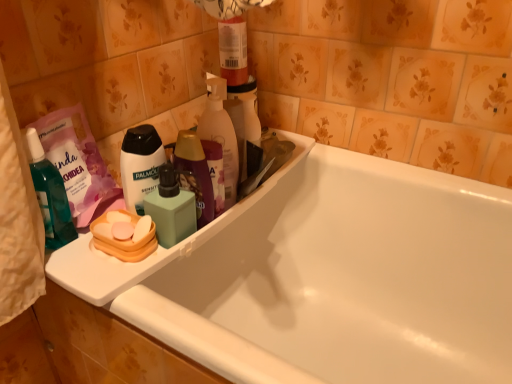
The width and height of the screenshot is (512, 384). Describe the element at coordinates (50, 195) in the screenshot. I see `translucent teal bottle at left, the second toiletry from the right` at that location.

In order to face white glossy bathtub at center, should I rotate leftwards or rightwards?

You should look right and rotate roughly 5.688 degrees.

Where is `white glossy bathtub at center`? The image size is (512, 384). white glossy bathtub at center is located at coordinates (328, 278).

Locate an element on the screen. This screenshot has height=384, width=512. green matte soap dispenser at center, the second toiletry positioned from the left is located at coordinates pos(170,208).

From a real-world perspective, between green matte soap dispenser at center, the first toiletry in the right-to-left sequence, and orange plastic soap at left, the first personal care in the bottom-to-top sequence, who is vertically higher?

green matte soap dispenser at center, the first toiletry in the right-to-left sequence, is physically above.

How many degrees apart are the facing directions of green matte soap dispenser at center, the second toiletry positioned from the left, and orange plastic soap at left, positioned as the 2th personal care in top-to-bottom order?

The facing directions of green matte soap dispenser at center, the second toiletry positioned from the left, and orange plastic soap at left, positioned as the 2th personal care in top-to-bottom order, are 0.00321 degrees apart.

Where is `toiletry that is behind the orange plastic soap at left, the first personal care in the bottom-to-top sequence`? The width and height of the screenshot is (512, 384). toiletry that is behind the orange plastic soap at left, the first personal care in the bottom-to-top sequence is located at coordinates (170, 208).

In the scene shown: Who is smaller, green matte soap dispenser at center, the first toiletry in the right-to-left sequence, or orange plastic soap at left, positioned as the 2th personal care in top-to-bottom order?

orange plastic soap at left, positioned as the 2th personal care in top-to-bottom order.

Considering the sizes of white glossy bathtub at center and orange plastic soap at left, the first personal care in the bottom-to-top sequence, in the image, is white glossy bathtub at center taller or shorter than orange plastic soap at left, the first personal care in the bottom-to-top sequence,?

In the image, white glossy bathtub at center appears to be taller than orange plastic soap at left, the first personal care in the bottom-to-top sequence.

Can you confirm if white glossy bathtub at center is positioned to the left of orange plastic soap at left, the first personal care in the bottom-to-top sequence?

Incorrect, white glossy bathtub at center is not on the left side of orange plastic soap at left, the first personal care in the bottom-to-top sequence.

Can you confirm if white glossy bathtub at center is wider than orange plastic soap at left, the first personal care in the bottom-to-top sequence?

Yes, white glossy bathtub at center is wider than orange plastic soap at left, the first personal care in the bottom-to-top sequence.

Is white glossy bathtub at center completely or partially outside of orange plastic soap at left, the first personal care in the bottom-to-top sequence?

white glossy bathtub at center is positioned outside orange plastic soap at left, the first personal care in the bottom-to-top sequence.

In terms of size, does white matte body wash at center, placed as the second personal care when sorted from bottom to top, appear bigger or smaller than orange plastic soap at left, the first personal care in the bottom-to-top sequence?

Considering their sizes, white matte body wash at center, placed as the second personal care when sorted from bottom to top, takes up more space than orange plastic soap at left, the first personal care in the bottom-to-top sequence.

Is white matte body wash at center, arranged as the 1th personal care when viewed from the top, inside or outside of orange plastic soap at left, positioned as the 2th personal care in top-to-bottom order?

white matte body wash at center, arranged as the 1th personal care when viewed from the top, exists outside the volume of orange plastic soap at left, positioned as the 2th personal care in top-to-bottom order.

Is white matte body wash at center, placed as the second personal care when sorted from bottom to top, oriented away from orange plastic soap at left, positioned as the 2th personal care in top-to-bottom order?

white matte body wash at center, placed as the second personal care when sorted from bottom to top, is not turned away from orange plastic soap at left, positioned as the 2th personal care in top-to-bottom order.

This screenshot has height=384, width=512. What are the coordinates of `personal care below the white matte body wash at center, arranged as the 1th personal care when viewed from the top (from the image's perspective)` in the screenshot? It's located at (124, 235).

Locate an element on the screen. This screenshot has height=384, width=512. sink below the translucent teal bottle at left, the first toiletry viewed from the left (from the image's perspective) is located at coordinates (152, 253).

Can you confirm if translucent teal bottle at left, the first toiletry viewed from the left, is positioned to the left of white plastic tray at upper left?

Yes.

Which object is further away from the camera, translucent teal bottle at left, the second toiletry from the right, or white plastic tray at upper left?

white plastic tray at upper left is further from the camera.

Is translucent teal bottle at left, the first toiletry viewed from the left, inside or outside of white plastic tray at upper left?

The correct answer is: outside.

Is translucent plastic bottle at upper center positioned far away from white glossy bathtub at center?

That's not correct — translucent plastic bottle at upper center is a little close to white glossy bathtub at center.

Is point (206, 133) positioned before point (386, 281)?

Yes, it is in front of point (386, 281).

From a real-world perspective, is translucent plastic bottle at upper center below white glossy bathtub at center?

No, from a real-world perspective, translucent plastic bottle at upper center is not under white glossy bathtub at center.

Is translucent plastic bottle at upper center oriented towards white glossy bathtub at center?

No, translucent plastic bottle at upper center is not aimed at white glossy bathtub at center.

Can you confirm if translucent teal bottle at left, the second toiletry from the right, is wider than white glossy bathtub at center?

Incorrect, the width of translucent teal bottle at left, the second toiletry from the right, does not surpass that of white glossy bathtub at center.

From the image's perspective, is translucent teal bottle at left, the first toiletry viewed from the left, under white glossy bathtub at center?

No, from the image's perspective, translucent teal bottle at left, the first toiletry viewed from the left, is not beneath white glossy bathtub at center.

Is translucent teal bottle at left, the second toiletry from the right, further to camera compared to white glossy bathtub at center?

Yes, translucent teal bottle at left, the second toiletry from the right, is behind white glossy bathtub at center.

From the picture: Based on their sizes in the image, would you say translucent teal bottle at left, the first toiletry viewed from the left, is bigger or smaller than white glossy bathtub at center?

In the image, translucent teal bottle at left, the first toiletry viewed from the left, appears to be smaller than white glossy bathtub at center.

Between translucent plastic bottle at upper center and translucent teal bottle at left, the second toiletry from the right, which one appears on the right side from the viewer's perspective?

translucent plastic bottle at upper center.

From the image's perspective, which one is positioned higher, translucent plastic bottle at upper center or translucent teal bottle at left, the first toiletry viewed from the left?

translucent plastic bottle at upper center is shown above in the image.

How far apart are translucent plastic bottle at upper center and translucent teal bottle at left, the second toiletry from the right?

translucent plastic bottle at upper center and translucent teal bottle at left, the second toiletry from the right, are 11.65 inches apart from each other.

Does translucent plastic bottle at upper center have a lesser width compared to translucent teal bottle at left, the first toiletry viewed from the left?

Yes, translucent plastic bottle at upper center is thinner than translucent teal bottle at left, the first toiletry viewed from the left.

From the green matte soap dispenser at center, the second toiletry positioned from the left, count the 2nd personal care to the left and point to it. Please provide its 2D coordinates.

[(124, 235)]

You are a GUI agent. You are given a task and a screenshot of the screen. Output one action in this format:
    pyautogui.click(x=<x>, y=<y>)
    Task: Click on the personal care that is the 1st one when counting upward from the white glossy bathtub at center (from the image's perspective)
    The width and height of the screenshot is (512, 384).
    Given the screenshot: What is the action you would take?
    pyautogui.click(x=124, y=235)

From the image, which object appears to be nearer to translucent teal bottle at left, the first toiletry viewed from the left, white glossy bathtub at center or orange plastic soap at left, the first personal care in the bottom-to-top sequence?

The object closer to translucent teal bottle at left, the first toiletry viewed from the left, is orange plastic soap at left, the first personal care in the bottom-to-top sequence.

When comparing their distances from white matte body wash at center, placed as the second personal care when sorted from bottom to top, does white glossy bathtub at center or green matte soap dispenser at center, the second toiletry positioned from the left, seem closer?

green matte soap dispenser at center, the second toiletry positioned from the left, is positioned closer to the anchor white matte body wash at center, placed as the second personal care when sorted from bottom to top.

Considering their positions, is translucent plastic bottle at upper center positioned closer to white plastic tray at upper left than white matte body wash at center, placed as the second personal care when sorted from bottom to top?

Among the two, translucent plastic bottle at upper center is located nearer to white plastic tray at upper left.

Which object lies nearer to the anchor point white glossy bathtub at center, translucent teal bottle at left, the first toiletry viewed from the left, or orange plastic soap at left, positioned as the 2th personal care in top-to-bottom order?

The object closer to white glossy bathtub at center is orange plastic soap at left, positioned as the 2th personal care in top-to-bottom order.

Based on the photo, when comparing their distances from white plastic tray at upper left, does white matte body wash at center, arranged as the 1th personal care when viewed from the top, or orange plastic soap at left, the first personal care in the bottom-to-top sequence, seem further?

white matte body wash at center, arranged as the 1th personal care when viewed from the top, is positioned further to the anchor white plastic tray at upper left.

Considering their positions, is white plastic tray at upper left positioned further to white matte body wash at center, placed as the second personal care when sorted from bottom to top, than translucent plastic bottle at upper center?

Based on the image, white plastic tray at upper left appears to be further to white matte body wash at center, placed as the second personal care when sorted from bottom to top.

Estimate the real-world distances between objects in this image. Which object is closer to white glossy bathtub at center, translucent teal bottle at left, the first toiletry viewed from the left, or translucent plastic bottle at upper center?

Among the two, translucent plastic bottle at upper center is located nearer to white glossy bathtub at center.

Based on the photo, estimate the real-world distances between objects in this image. Which object is further from green matte soap dispenser at center, the second toiletry positioned from the left, translucent teal bottle at left, the second toiletry from the right, or white plastic tray at upper left?

Based on the image, translucent teal bottle at left, the second toiletry from the right, appears to be further to green matte soap dispenser at center, the second toiletry positioned from the left.

You are a GUI agent. You are given a task and a screenshot of the screen. Output one action in this format:
    pyautogui.click(x=<x>, y=<y>)
    Task: Click on the sink located between white glossy bathtub at center and orange plastic soap at left, the first personal care in the bottom-to-top sequence, in the depth direction
    
    Given the screenshot: What is the action you would take?
    pyautogui.click(x=152, y=253)

At what (x,y) coordinates should I click in order to perform the action: click on toiletry between translucent teal bottle at left, the first toiletry viewed from the left, and white glossy bathtub at center from left to right. Please return your answer as a coordinate pair (x, y). The image size is (512, 384). Looking at the image, I should click on (170, 208).

Find the location of a particular element. sink situated between white matte body wash at center, arranged as the 1th personal care when viewed from the top, and translucent plastic bottle at upper center from left to right is located at coordinates (152, 253).

The image size is (512, 384). I want to click on sink located between translucent teal bottle at left, the first toiletry viewed from the left, and white glossy bathtub at center in the left-right direction, so click(152, 253).